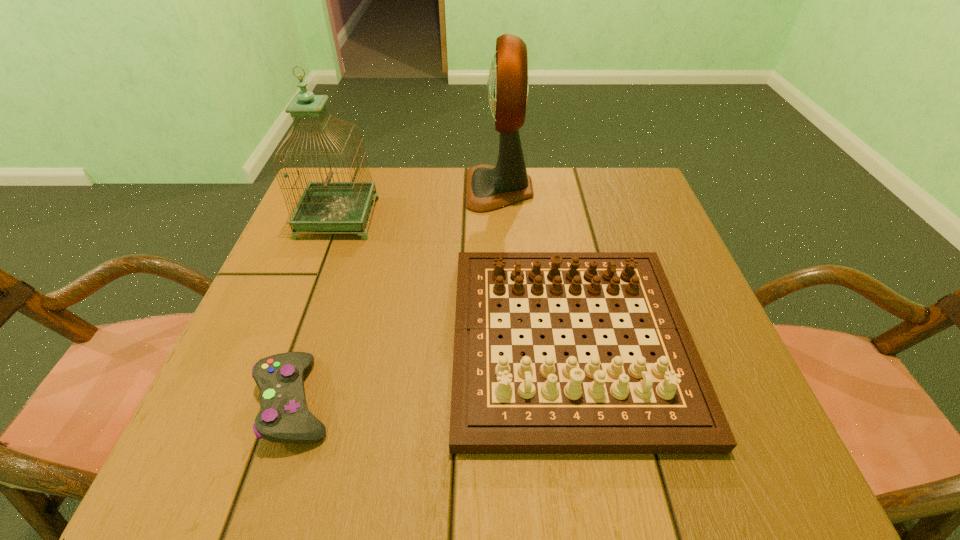
The image size is (960, 540). In order to click on blank region between the birdcage and the control in this screenshot , I will do `click(317, 309)`.

Locate which object ranks second in proximity to the shortest object. Please provide its 2D coordinates. Your answer should be formatted as a tuple, i.e. [(x, y)], where the tuple contains the x and y coordinates of a point satisfying the conditions above.

[(324, 206)]

Identify which object is the second closest to the gameboard. Please provide its 2D coordinates. Your answer should be formatted as a tuple, i.e. [(x, y)], where the tuple contains the x and y coordinates of a point satisfying the conditions above.

[(284, 417)]

You are a GUI agent. You are given a task and a screenshot of the screen. Output one action in this format:
    pyautogui.click(x=<x>, y=<y>)
    Task: Click on the free location that satisfies the following two spatial constraints: 1. at the door of the birdcage; 2. on the right side of the control
    This screenshot has height=540, width=960.
    Given the screenshot: What is the action you would take?
    pyautogui.click(x=271, y=401)

The height and width of the screenshot is (540, 960). I want to click on vacant area in the image that satisfies the following two spatial constraints: 1. at the door of the control; 2. on the right side of the birdcage, so click(x=271, y=401).